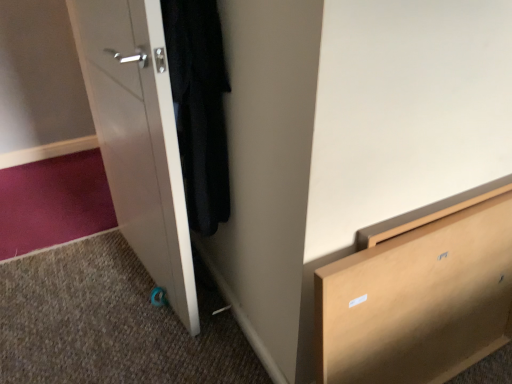
Question: Is white glossy door at left inside or outside of black matte coat at left?

Choices:
 (A) inside
 (B) outside

Answer: (B)

Question: Is point (152, 104) positioned closer to the camera than point (199, 165)?

Choices:
 (A) closer
 (B) farther

Answer: (A)

Question: Which of these objects is positioned closest to the white glossy door at left?

Choices:
 (A) light brown wooden chest of drawers at lower right
 (B) black matte coat at left

Answer: (B)

Question: Which object is positioned farthest from the light brown wooden chest of drawers at lower right?

Choices:
 (A) black matte coat at left
 (B) white glossy door at left

Answer: (B)